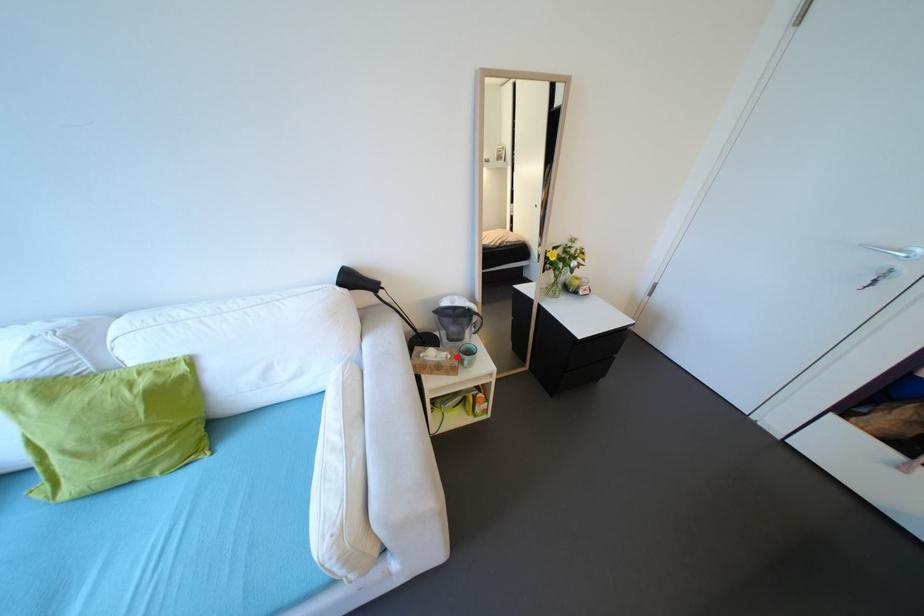
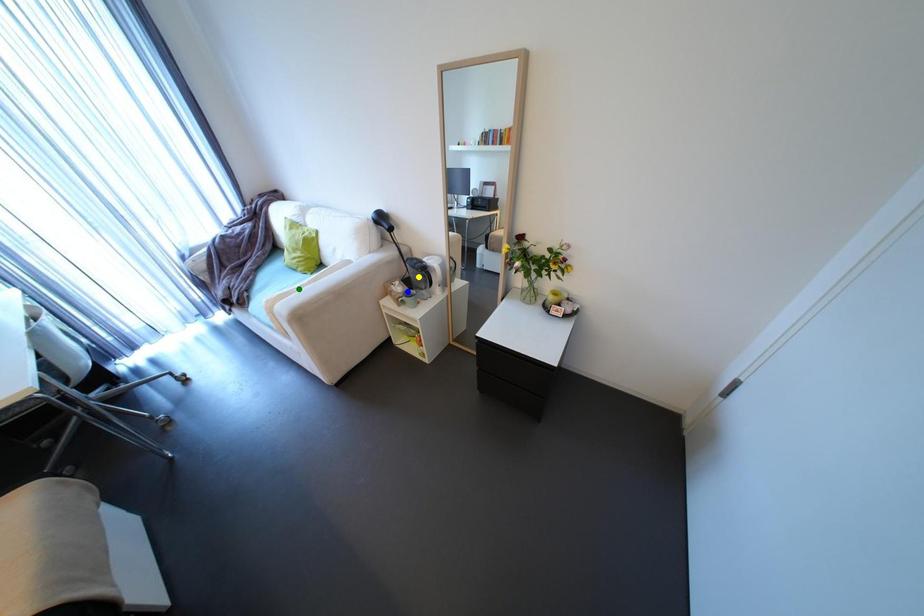
Question: I am providing you with two images of the same scene from different viewpoints. A red point is marked on the first image. You are given multiple points on the second image. Which point in image 2 represents the same 3d spot as the red point in image 1?

Choices:
 (A) blue point
 (B) green point
 (C) yellow point

Answer: (A)